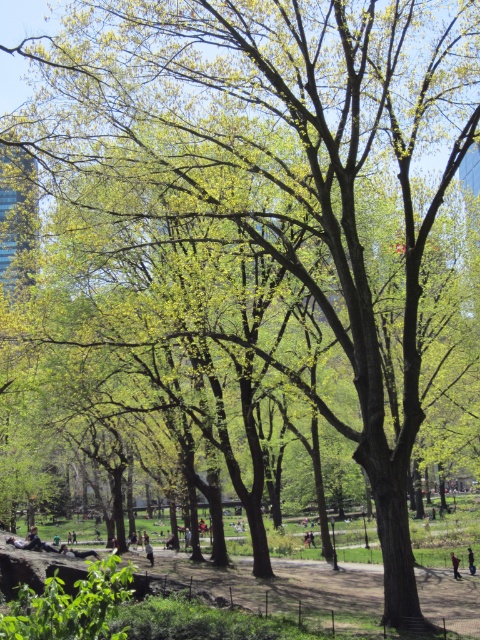
Question: Is green leafy trees at center bigger than dark blue jeans at center?

Choices:
 (A) no
 (B) yes

Answer: (B)

Question: Which object appears closest to the camera in this image?

Choices:
 (A) dark blue jeans at center
 (B) dark brown leather jacket at lower right
 (C) light brown wooden bench at center
 (D) green leafy trees at center

Answer: (D)

Question: Which point is closer to the camera?

Choices:
 (A) (349, 614)
 (B) (455, 557)

Answer: (A)

Question: Is green leafy trees at center to the left of dark brown leather jacket at lower right from the viewer's perspective?

Choices:
 (A) no
 (B) yes

Answer: (B)

Question: Which of the following is the farthest from the observer?

Choices:
 (A) light brown wooden bench at center
 (B) dark blue jeans at center
 (C) green leafy trees at center

Answer: (A)

Question: Is green leafy trees at center to the right of light brown wooden bench at center from the viewer's perspective?

Choices:
 (A) no
 (B) yes

Answer: (B)